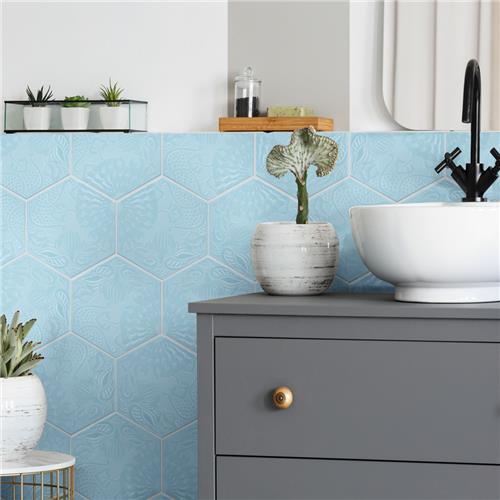
The width and height of the screenshot is (500, 500). What are the coordinates of `plant` in the screenshot? It's located at (300, 212), (30, 370), (39, 95), (76, 98), (107, 91).